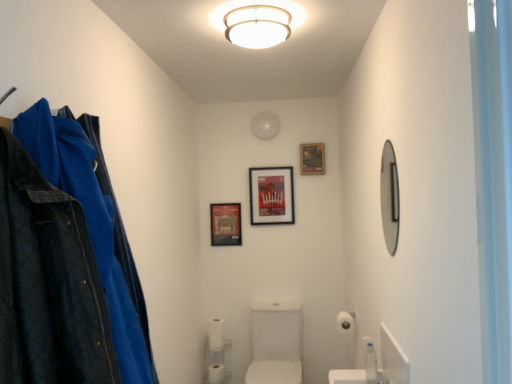
Question: From a real-world perspective, is white glossy sink at center physically located above or below white plastic shelf at lower center?

Choices:
 (A) below
 (B) above

Answer: (B)

Question: From the image's perspective, is white glossy sink at center positioned above or below white plastic shelf at lower center?

Choices:
 (A) below
 (B) above

Answer: (B)

Question: Considering the real-world distances, which object is farthest from the white glossy sink at center?

Choices:
 (A) white matte toilet paper at lower center, placed as the second toilet paper when sorted from front to back
 (B) white matte toilet paper at lower center, which ranks as the third toilet paper in front-to-back order
 (C) white matte toilet paper at lower right, which appears as the third toilet paper when viewed from the back
 (D) matte black picture frame at upper center, arranged as the 1th picture frame when viewed from the right
 (E) clear plastic bottle at lower right

Answer: (D)

Question: Which is nearer to the metallic poster at center, acting as the third picture frame starting from the right?

Choices:
 (A) white glossy sink at center
 (B) matte plastic picture frame at center, marked as the 2th picture frame in a left-to-right arrangement
 (C) white matte ceiling light at upper center
 (D) clear plastic bottle at lower right
 (E) white plastic shelf at lower center

Answer: (B)